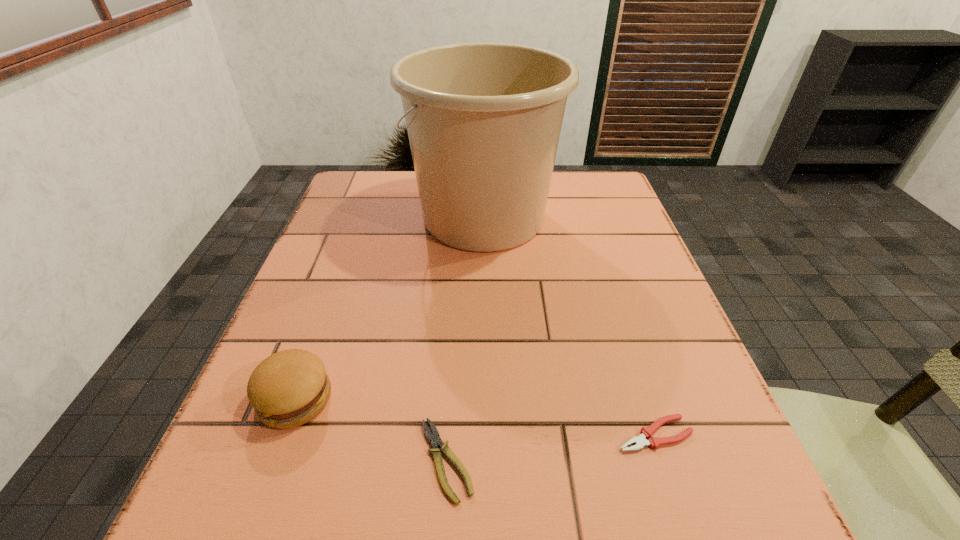
Find the location of a particular element. The image size is (960, 540). vacant space that is in between the tallest object and the right pliers is located at coordinates (569, 326).

Select which object is the closest to the hamburger. Please provide its 2D coordinates. Your answer should be formatted as a tuple, i.e. [(x, y)], where the tuple contains the x and y coordinates of a point satisfying the conditions above.

[(434, 439)]

In order to click on object that can be found as the closest to the right pliers in this screenshot , I will do `click(434, 439)`.

The height and width of the screenshot is (540, 960). I want to click on free space that satisfies the following two spatial constraints: 1. on the front side of the rightmost object; 2. on the right side of the hamburger, so click(282, 434).

Where is `vacant area in the image that satisfies the following two spatial constraints: 1. on the back side of the hamburger; 2. on the right side of the tallest object`? vacant area in the image that satisfies the following two spatial constraints: 1. on the back side of the hamburger; 2. on the right side of the tallest object is located at coordinates (361, 218).